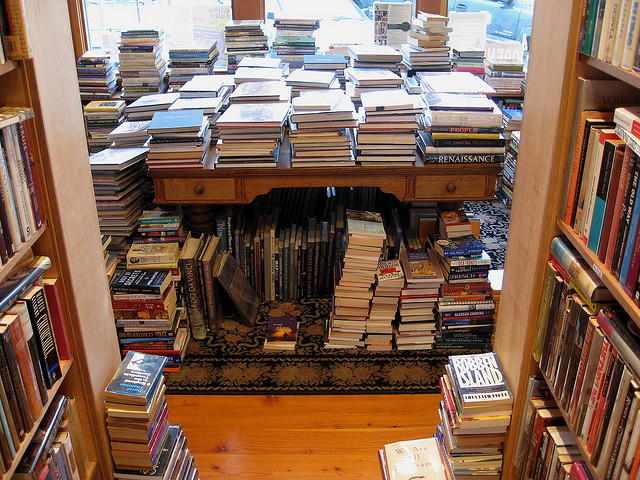
The image size is (640, 480). Find the location of `window`. window is located at coordinates (493, 34).